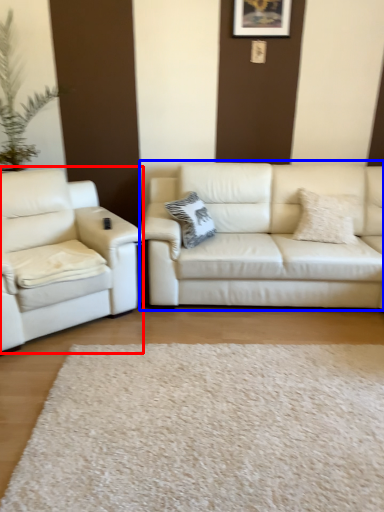
Question: Which point is further to the camera, studio couch (highlighted by a red box) or studio couch (highlighted by a blue box)?

Choices:
 (A) studio couch
 (B) studio couch

Answer: (B)